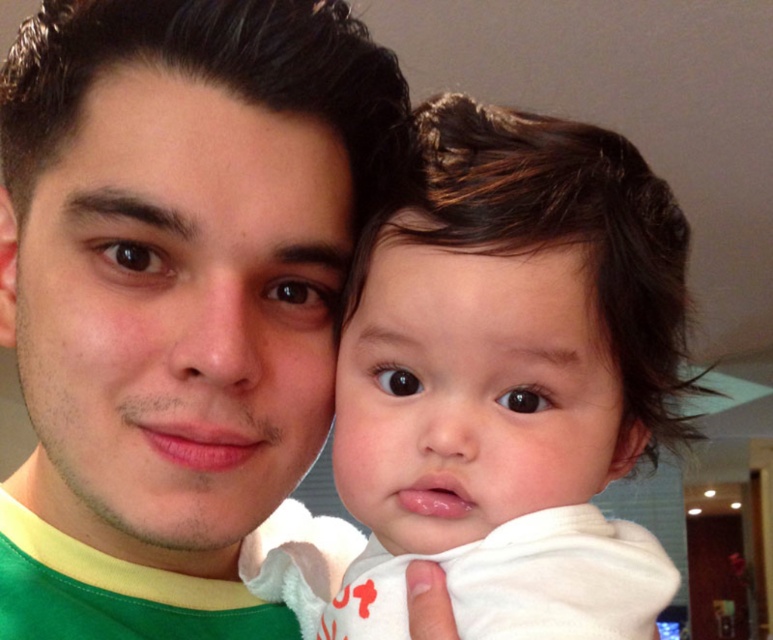
Question: Does green/yellow t-shirt at center lie behind soft white towel at center?

Choices:
 (A) yes
 (B) no

Answer: (A)

Question: Among these points, which one is nearest to the camera?

Choices:
 (A) coord(300,61)
 (B) coord(574,612)

Answer: (B)

Question: Which point is closer to the camera?

Choices:
 (A) green/yellow t-shirt at center
 (B) soft white towel at center

Answer: (B)

Question: Which point appears farthest from the camera in this image?

Choices:
 (A) (111, 330)
 (B) (353, 362)

Answer: (B)

Question: In this image, where is green/yellow t-shirt at center located relative to soft white towel at center?

Choices:
 (A) right
 (B) left

Answer: (B)

Question: Can you confirm if green/yellow t-shirt at center is positioned above soft white towel at center?

Choices:
 (A) yes
 (B) no

Answer: (A)